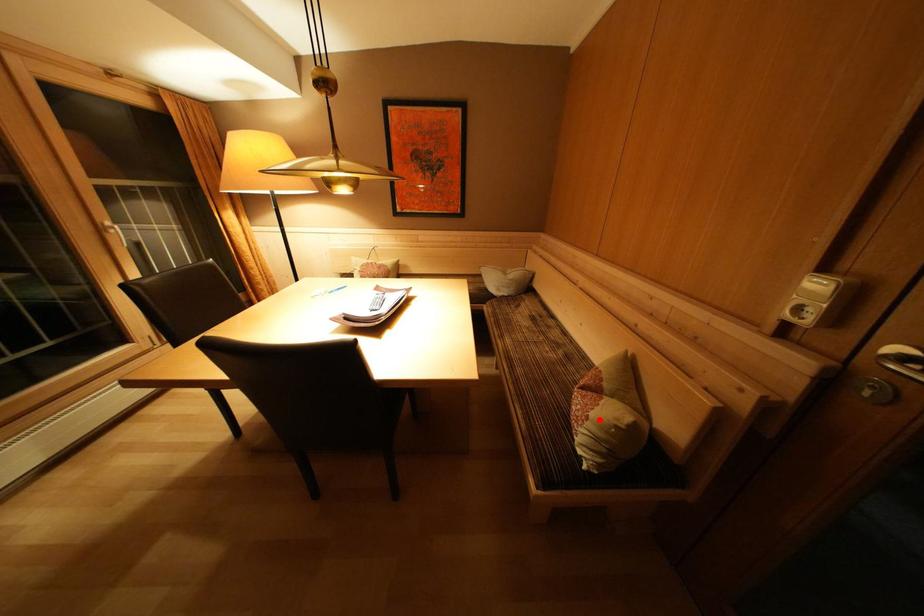
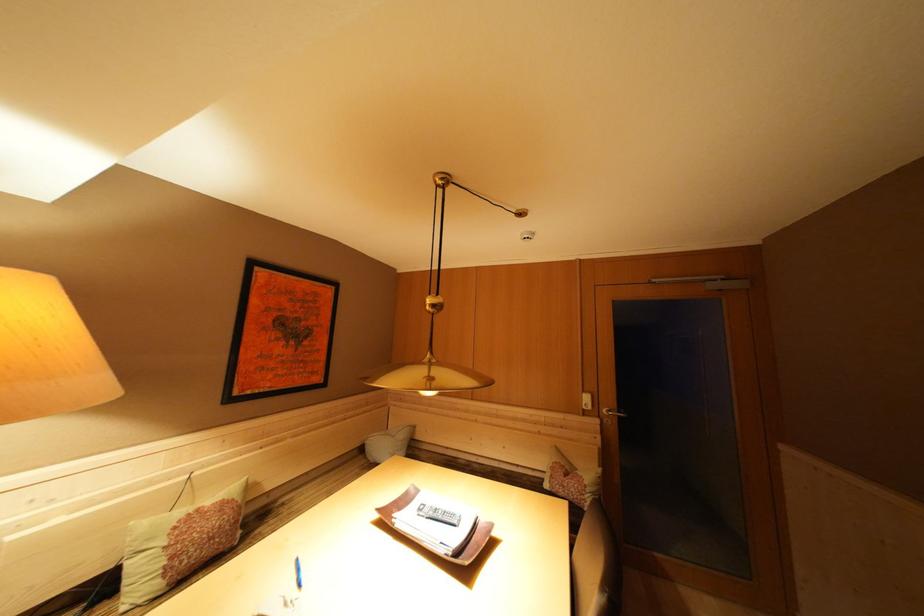
Locate, in the second image, the point that corresponds to the highlighted location in the first image.

(592, 487)